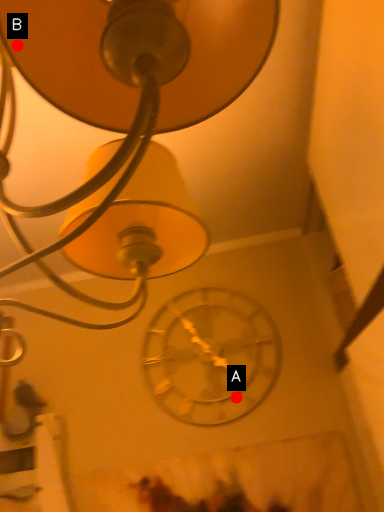
Question: Two points are circled on the image, labeled by A and B beside each circle. Which of the following is the farthest from the observer?

Choices:
 (A) A is further
 (B) B is further

Answer: (A)